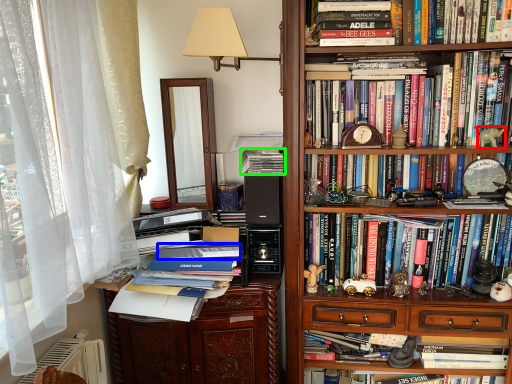
Question: Based on their relative distances, which object is farther from toy (highlighted by a red box)? Choose from paperback book (highlighted by a blue box) and book (highlighted by a green box).

Choices:
 (A) paperback book
 (B) book

Answer: (A)